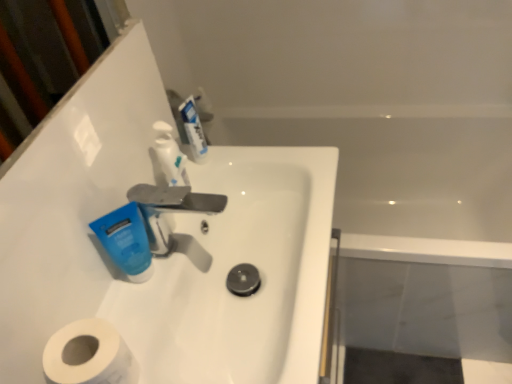
Question: Is white glossy sink at center surrounded by white glossy bathtub at upper right?

Choices:
 (A) yes
 (B) no

Answer: (B)

Question: Is white glossy bathtub at upper right bigger than white glossy sink at center?

Choices:
 (A) yes
 (B) no

Answer: (A)

Question: From a real-world perspective, is white glossy bathtub at upper right beneath white glossy sink at center?

Choices:
 (A) yes
 (B) no

Answer: (A)

Question: Does white glossy bathtub at upper right lie in front of white glossy sink at center?

Choices:
 (A) yes
 (B) no

Answer: (B)

Question: From the image's perspective, would you say white glossy bathtub at upper right is shown under white glossy sink at center?

Choices:
 (A) no
 (B) yes

Answer: (A)

Question: Is white glossy bathtub at upper right facing away from white glossy sink at center?

Choices:
 (A) yes
 (B) no

Answer: (B)

Question: Is white glossy mouthwash at upper center, marked as the first mouthwash in a back-to-front arrangement, oriented towards white matte toilet paper at lower left?

Choices:
 (A) no
 (B) yes

Answer: (A)

Question: From the image's perspective, would you say white glossy mouthwash at upper center, which is counted as the second mouthwash, starting from the left, is positioned over white matte toilet paper at lower left?

Choices:
 (A) yes
 (B) no

Answer: (A)

Question: From a real-world perspective, is white glossy mouthwash at upper center, marked as the first mouthwash in a back-to-front arrangement, positioned over white matte toilet paper at lower left based on gravity?

Choices:
 (A) no
 (B) yes

Answer: (B)

Question: Is white glossy mouthwash at upper center, acting as the first mouthwash starting from the right, in front of white matte toilet paper at lower left?

Choices:
 (A) no
 (B) yes

Answer: (A)

Question: Does white glossy mouthwash at upper center, the second mouthwash in the front-to-back sequence, lie behind white matte toilet paper at lower left?

Choices:
 (A) yes
 (B) no

Answer: (A)

Question: Is white glossy mouthwash at upper center, marked as the first mouthwash in a back-to-front arrangement, smaller than white matte toilet paper at lower left?

Choices:
 (A) no
 (B) yes

Answer: (B)

Question: Are white glossy mouthwash at upper center, acting as the first mouthwash starting from the right, and white glossy soap dispenser at upper center far apart?

Choices:
 (A) no
 (B) yes

Answer: (A)